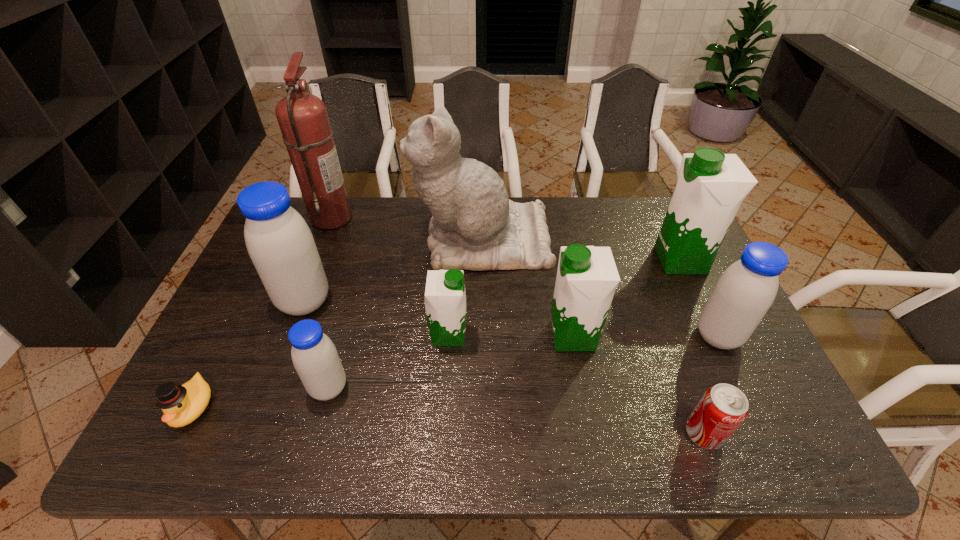
Identify the location of vacant position located on the front-facing side of the cat. This screenshot has height=540, width=960. (331, 239).

Image resolution: width=960 pixels, height=540 pixels. In order to click on vacant area situated on the front-facing side of the farthest soya milk in this screenshot , I will do `click(540, 260)`.

Where is `vacant area situated on the front-facing side of the farthest soya milk`? The height and width of the screenshot is (540, 960). vacant area situated on the front-facing side of the farthest soya milk is located at coordinates (625, 260).

What are the coordinates of `vacant space located on the front-facing side of the farthest soya milk` in the screenshot? It's located at (632, 260).

Locate an element on the screen. The image size is (960, 540). free space located 0.170m on the right of the leftmost blue soya milk is located at coordinates (391, 302).

At what (x,y) coordinates should I click in order to perform the action: click on vacant area located on the front-facing side of the second green soya milk from right to left. Please return your answer as a coordinate pair (x, y). The height and width of the screenshot is (540, 960). Looking at the image, I should click on (507, 336).

Find the location of `vacant position located on the front-facing side of the second green soya milk from right to left`. vacant position located on the front-facing side of the second green soya milk from right to left is located at coordinates (522, 336).

Find the location of a particular element. Image resolution: width=960 pixels, height=540 pixels. free space located on the front-facing side of the second green soya milk from right to left is located at coordinates (515, 336).

Find the location of a particular element. free space located 0.350m on the left of the second biggest blue soya milk is located at coordinates (564, 336).

The image size is (960, 540). In order to click on vacant space positioned on the front-facing side of the fourth soya milk from right to left in this screenshot , I will do `click(519, 335)`.